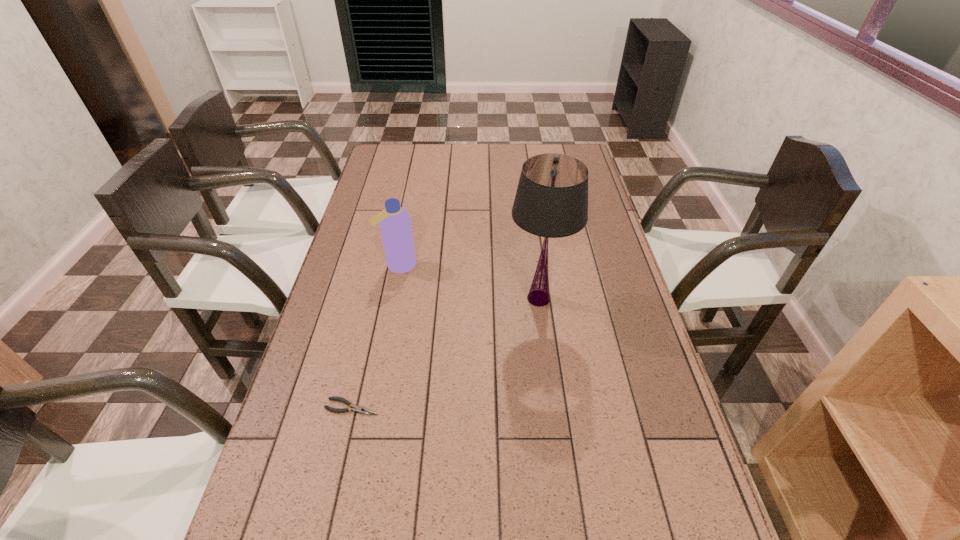
In order to click on vacant space located 0.370m on the back of the shortest object in this screenshot , I will do `click(379, 289)`.

This screenshot has width=960, height=540. In order to click on shampoo positioned at the left edge in this screenshot , I will do `click(395, 222)`.

You are a GUI agent. You are given a task and a screenshot of the screen. Output one action in this format:
    pyautogui.click(x=<x>, y=<y>)
    Task: Click on the pliers at the left edge
    The height and width of the screenshot is (540, 960).
    Given the screenshot: What is the action you would take?
    pyautogui.click(x=362, y=410)

Image resolution: width=960 pixels, height=540 pixels. Identify the location of free region at the far edge. (444, 167).

You are a GUI agent. You are given a task and a screenshot of the screen. Output one action in this format:
    pyautogui.click(x=<x>, y=<y>)
    Task: Click on the free region at the left edge of the desktop
    
    Given the screenshot: What is the action you would take?
    pyautogui.click(x=343, y=415)

Locate an element on the screen. This screenshot has height=540, width=960. vacant space at the right edge of the desktop is located at coordinates (595, 203).

The width and height of the screenshot is (960, 540). What are the coordinates of `vacant area that lies between the shortest object and the second tallest object` in the screenshot? It's located at (375, 336).

The height and width of the screenshot is (540, 960). I want to click on vacant space in between the rightmost object and the shortest object, so click(x=445, y=353).

The width and height of the screenshot is (960, 540). I want to click on empty location between the farthest object and the nearest object, so click(x=375, y=336).

In order to click on free space that is in between the farthest object and the pliers in this screenshot , I will do `click(375, 336)`.